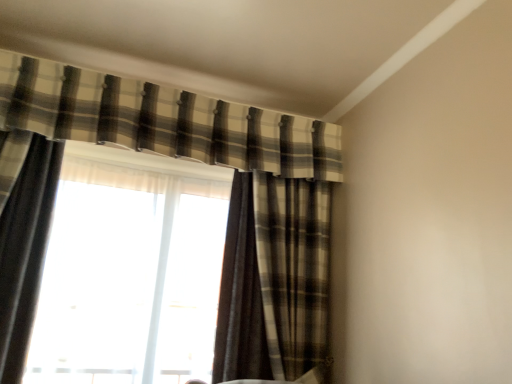
Question: Is point (236, 369) positioned closer to the camera than point (181, 150)?

Choices:
 (A) closer
 (B) farther

Answer: (A)

Question: Is brown plaid curtain at center, acting as the 3th curtain starting from the left, wider or thinner than plaid fabric curtain at upper center, which is counted as the 2th curtain, starting from the right?

Choices:
 (A) wide
 (B) thin

Answer: (A)

Question: Which object is positioned closest to the brown plaid curtain at center, the 1th curtain when ordered from right to left?

Choices:
 (A) plaid fabric curtain at upper center, marked as the 2th curtain in a left-to-right arrangement
 (B) plaid fabric curtain at left, the 1th curtain when ordered from left to right
 (C) translucent fabric at center

Answer: (C)

Question: Estimate the real-world distances between objects in this image. Which object is farther from the translucent fabric at center?

Choices:
 (A) plaid fabric curtain at left, the 1th curtain when ordered from left to right
 (B) plaid fabric curtain at upper center, marked as the 2th curtain in a left-to-right arrangement
 (C) brown plaid curtain at center, acting as the 3th curtain starting from the left

Answer: (B)